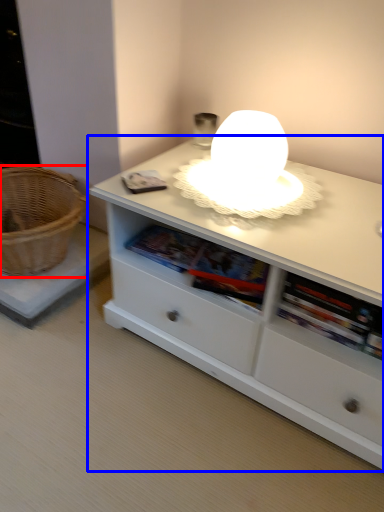
Question: Among these objects, which one is nearest to the camera, basket (highlighted by a red box) or table (highlighted by a blue box)?

Choices:
 (A) basket
 (B) table

Answer: (B)